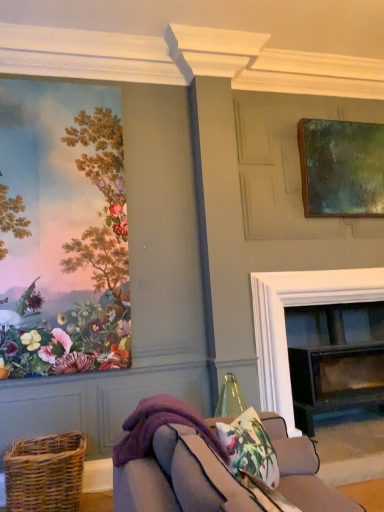
At what (x,y) coordinates should I click in order to perform the action: click on woven brown basket at lower left. Please return your answer as a coordinate pair (x, y). Image resolution: width=384 pixels, height=512 pixels. Looking at the image, I should click on (45, 473).

This screenshot has height=512, width=384. Describe the element at coordinates (177, 477) in the screenshot. I see `purple fleece couch at lower center` at that location.

In order to face purple fleece blanket at lower center, should I rotate leftwards or rightwards?

To face it directly, rotate left by 2.314 degrees.

At what (x,y) coordinates should I click in order to perform the action: click on floral fabric cushion at lower center. Please return your answer as a coordinate pair (x, y). The image size is (384, 512). Looking at the image, I should click on (250, 448).

What do you see at coordinates (285, 326) in the screenshot?
I see `black glass fireplace at center` at bounding box center [285, 326].

At what (x,y) coordinates should I click in order to perform the action: click on woven brown basket at lower left. Please return your answer as a coordinate pair (x, y). The height and width of the screenshot is (512, 384). Looking at the image, I should click on (45, 473).

Is black glass fireplace at center facing away from purple fleece blanket at lower center?

No, black glass fireplace at center's orientation is not away from purple fleece blanket at lower center.

From the image's perspective, is black glass fireplace at center on top of purple fleece blanket at lower center?

Actually, black glass fireplace at center appears below purple fleece blanket at lower center in the image.

The image size is (384, 512). I want to click on blanket that is on the left side of black glass fireplace at center, so click(159, 426).

Does woven brown basket at lower left lie in front of floral fabric cushion at lower center?

No, the depth of woven brown basket at lower left is greater than that of floral fabric cushion at lower center.

Looking at this image, considering the relative positions of woven brown basket at lower left and floral fabric cushion at lower center in the image provided, is woven brown basket at lower left to the left or to the right of floral fabric cushion at lower center?

Clearly, woven brown basket at lower left is on the left of floral fabric cushion at lower center in the image.

Considering the sizes of woven brown basket at lower left and floral fabric cushion at lower center in the image, is woven brown basket at lower left taller or shorter than floral fabric cushion at lower center?

Considering their sizes, woven brown basket at lower left has more height than floral fabric cushion at lower center.

Can you tell me how much woven brown basket at lower left and floral fabric cushion at lower center differ in facing direction?

The angle between the facing direction of woven brown basket at lower left and the facing direction of floral fabric cushion at lower center is 45.7 degrees.

Which is less distant, (224, 450) or (364, 202)?

The point (224, 450) is more forward.

In the scene shown: From a real-world perspective, relative to greenish-brown wooden frame at upper right, the 2th picture frame from the front, is purple fleece blanket at lower center vertically above or below?

In terms of real-world spatial position, purple fleece blanket at lower center is below greenish-brown wooden frame at upper right, the 2th picture frame from the front.

Is purple fleece blanket at lower center touching greenish-brown wooden frame at upper right, the 2th picture frame from the front?

No, purple fleece blanket at lower center is not making contact with greenish-brown wooden frame at upper right, the 2th picture frame from the front.

In the scene shown: Is purple fleece blanket at lower center further to camera compared to greenish-brown wooden frame at upper right, which appears as the first picture frame when viewed from the right?

No, it is in front of greenish-brown wooden frame at upper right, which appears as the first picture frame when viewed from the right.

Is greenish-brown wooden frame at upper right, the 2th picture frame from the front, positioned in front of black glass fireplace at center?

No, greenish-brown wooden frame at upper right, the 2th picture frame from the front, is behind black glass fireplace at center.

Which is nearer, [323,184] or [257,310]?

Point [323,184].

Can you tell me how much black glass fireplace at center and purple fleece couch at lower center differ in facing direction?

The facing directions of black glass fireplace at center and purple fleece couch at lower center are 88.3 degrees apart.

From the image's perspective, which one is positioned lower, black glass fireplace at center or purple fleece couch at lower center?

From the image's view, black glass fireplace at center is below.

Considering the relative sizes of black glass fireplace at center and purple fleece couch at lower center in the image provided, is black glass fireplace at center thinner than purple fleece couch at lower center?

Indeed, black glass fireplace at center has a lesser width compared to purple fleece couch at lower center.

Considering the sizes of black glass fireplace at center and purple fleece couch at lower center in the image, is black glass fireplace at center taller or shorter than purple fleece couch at lower center?

Clearly, black glass fireplace at center is taller compared to purple fleece couch at lower center.

From a real-world perspective, is purple fleece couch at lower center over greenish-brown wooden frame at upper right, which appears as the first picture frame when viewed from the right?

No, from a real-world perspective, purple fleece couch at lower center is not above greenish-brown wooden frame at upper right, which appears as the first picture frame when viewed from the right.

Is purple fleece couch at lower center situated inside greenish-brown wooden frame at upper right, the 2th picture frame from the front, or outside?

purple fleece couch at lower center is not inside greenish-brown wooden frame at upper right, the 2th picture frame from the front, it's outside.

Where is `studio couch lying on the left of greenish-brown wooden frame at upper right, arranged as the second picture frame when viewed from the left`? This screenshot has width=384, height=512. studio couch lying on the left of greenish-brown wooden frame at upper right, arranged as the second picture frame when viewed from the left is located at coordinates (177, 477).

Does point (296, 456) lie behind point (361, 169)?

No, (296, 456) is closer to viewer.

What's the angular difference between greenish-brown wooden frame at upper right, acting as the first picture frame starting from the back, and floral fabric cushion at lower center's facing directions?

The angular difference between greenish-brown wooden frame at upper right, acting as the first picture frame starting from the back, and floral fabric cushion at lower center is 43.8 degrees.

From the image's perspective, is greenish-brown wooden frame at upper right, acting as the first picture frame starting from the back, on top of floral fabric cushion at lower center?

Indeed, from the image's perspective, greenish-brown wooden frame at upper right, acting as the first picture frame starting from the back, is shown above floral fabric cushion at lower center.

Where is `pillow below the greenish-brown wooden frame at upper right, arranged as the second picture frame when viewed from the left (from the image's perspective)`? This screenshot has width=384, height=512. pillow below the greenish-brown wooden frame at upper right, arranged as the second picture frame when viewed from the left (from the image's perspective) is located at coordinates (250, 448).

The image size is (384, 512). Identify the location of fireplace on the right of purple fleece blanket at lower center. (285, 326).

Identify the location of basket below the floral fabric cushion at lower center (from the image's perspective). This screenshot has width=384, height=512. (45, 473).

Based on the photo, which object lies nearer to the anchor point floral fabric cushion at lower center, black glass fireplace at center or greenish-brown wooden frame at upper right, acting as the first picture frame starting from the back?

black glass fireplace at center is positioned closer to the anchor floral fabric cushion at lower center.

Which object lies further to the anchor point matte floral wallpaper at left, the 1th picture frame positioned from the front, purple fleece blanket at lower center or black glass fireplace at center?

purple fleece blanket at lower center is positioned further to the anchor matte floral wallpaper at left, the 1th picture frame positioned from the front.

Looking at the image, which one is located closer to matte floral wallpaper at left, the second picture frame positioned from the right, greenish-brown wooden frame at upper right, acting as the first picture frame starting from the back, or purple fleece couch at lower center?

purple fleece couch at lower center is positioned closer to the anchor matte floral wallpaper at left, the second picture frame positioned from the right.

When comparing their distances from purple fleece blanket at lower center, does woven brown basket at lower left or black glass fireplace at center seem closer?

woven brown basket at lower left.

Based on their spatial positions, is greenish-brown wooden frame at upper right, the 2th picture frame from the front, or black glass fireplace at center closer to woven brown basket at lower left?

Based on the image, black glass fireplace at center appears to be nearer to woven brown basket at lower left.

From the image, which object appears to be nearer to matte floral wallpaper at left, which is the 1th picture frame in left-to-right order, purple fleece couch at lower center or black glass fireplace at center?

The object closer to matte floral wallpaper at left, which is the 1th picture frame in left-to-right order, is black glass fireplace at center.

Which object lies nearer to the anchor point woven brown basket at lower left, purple fleece couch at lower center or floral fabric cushion at lower center?

floral fabric cushion at lower center is closer to woven brown basket at lower left.

Looking at the image, which one is located further to black glass fireplace at center, purple fleece blanket at lower center or purple fleece couch at lower center?

Based on the image, purple fleece couch at lower center appears to be further to black glass fireplace at center.

Locate an element on the screen. pillow between purple fleece couch at lower center and woven brown basket at lower left from front to back is located at coordinates (250, 448).

Image resolution: width=384 pixels, height=512 pixels. I want to click on blanket situated between woven brown basket at lower left and floral fabric cushion at lower center from left to right, so click(159, 426).

At what (x,y) coordinates should I click in order to perform the action: click on blanket situated between woven brown basket at lower left and greenish-brown wooden frame at upper right, the 2th picture frame from the front, from left to right. Please return your answer as a coordinate pair (x, y). The width and height of the screenshot is (384, 512). Looking at the image, I should click on (159, 426).

You are a GUI agent. You are given a task and a screenshot of the screen. Output one action in this format:
    pyautogui.click(x=<x>, y=<y>)
    Task: Click on the picture frame positioned between purple fleece couch at lower center and black glass fireplace at center from near to far
    The height and width of the screenshot is (512, 384).
    Given the screenshot: What is the action you would take?
    pyautogui.click(x=62, y=230)